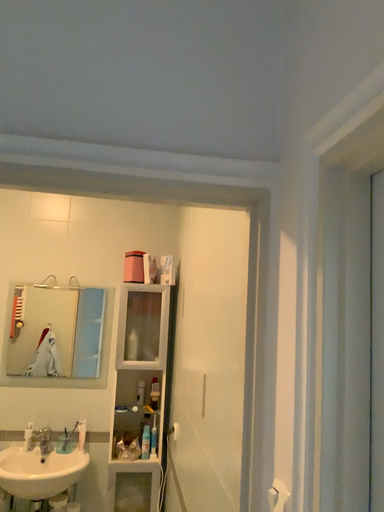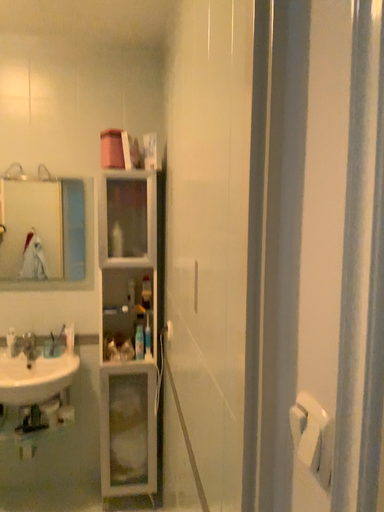
Question: Which way did the camera rotate in the video?

Choices:
 (A) rotated upward
 (B) rotated downward

Answer: (B)